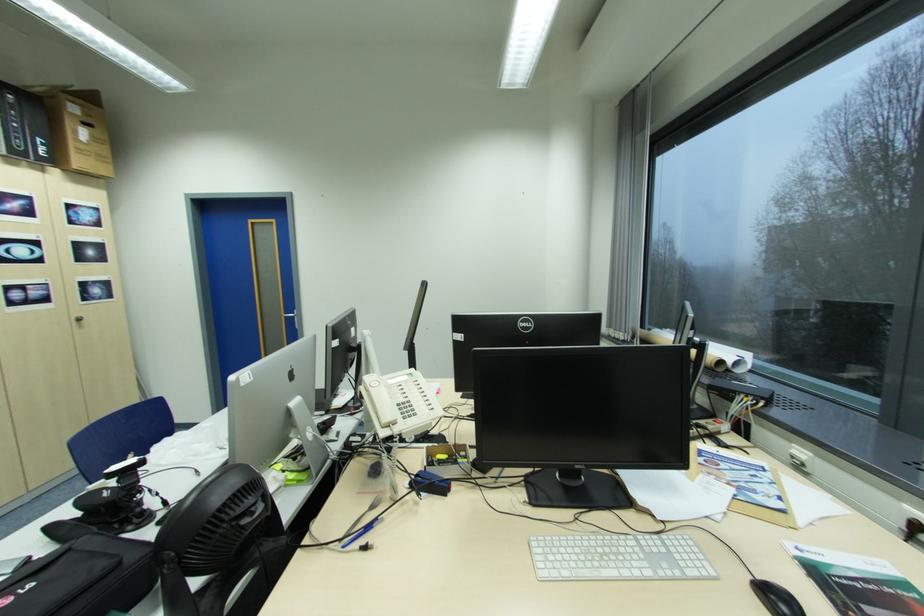
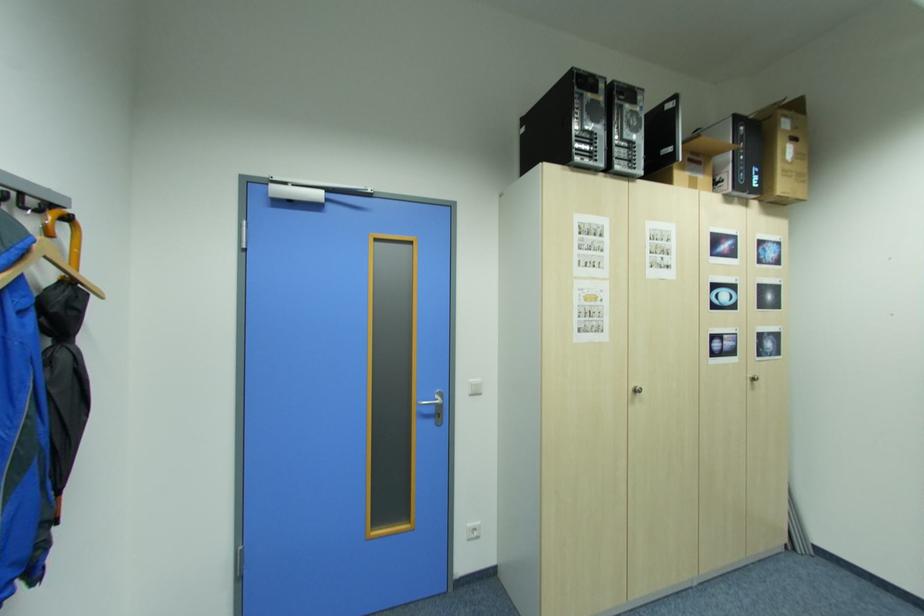
The point at [51,150] is marked in the first image. Where is the corresponding point in the second image?

(762, 179)